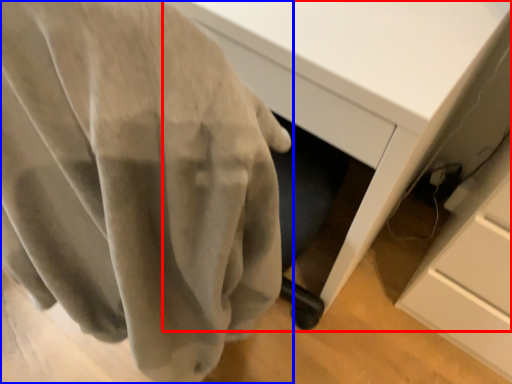
Question: Which of the following is the farthest to the observer, desk (highlighted by a red box) or curtain (highlighted by a blue box)?

Choices:
 (A) desk
 (B) curtain

Answer: (A)